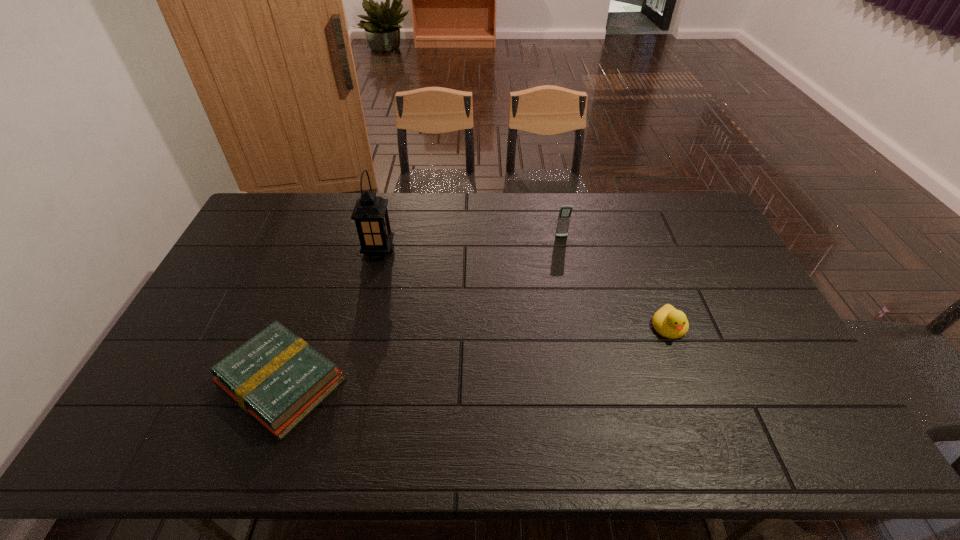
The image size is (960, 540). Find the location of `object positioned at the near edge`. object positioned at the near edge is located at coordinates (276, 377).

The height and width of the screenshot is (540, 960). I want to click on object located at the left edge, so click(x=276, y=377).

Locate an element on the screen. object situated at the near left corner is located at coordinates (276, 377).

Where is `free spot at the far edge of the desktop`? This screenshot has height=540, width=960. free spot at the far edge of the desktop is located at coordinates (495, 232).

Locate an element on the screen. Image resolution: width=960 pixels, height=540 pixels. blank space at the near edge of the desktop is located at coordinates (430, 443).

The image size is (960, 540). Find the location of `vacant region at the left edge of the desktop`. vacant region at the left edge of the desktop is located at coordinates (165, 372).

Where is `free space at the right edge of the desktop`? The height and width of the screenshot is (540, 960). free space at the right edge of the desktop is located at coordinates (800, 410).

This screenshot has height=540, width=960. I want to click on blank space at the far left corner, so click(270, 200).

Where is `vacant point at the near right corner`? Image resolution: width=960 pixels, height=540 pixels. vacant point at the near right corner is located at coordinates (819, 438).

The image size is (960, 540). Identify the location of vacant point located between the rightmost object and the hardback book. (475, 355).